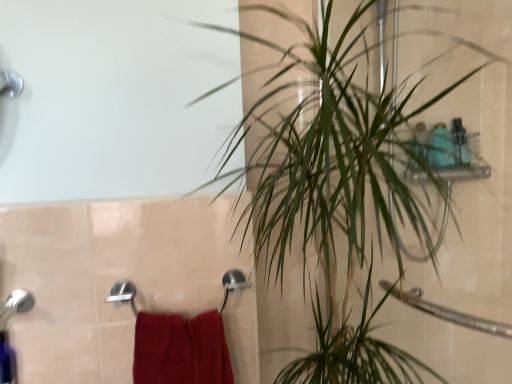
Question: Can you confirm if red cotton towel at lower left is smaller than green leafy plant at upper right?

Choices:
 (A) no
 (B) yes

Answer: (B)

Question: From the image's perspective, is red cotton towel at lower left under green leafy plant at upper right?

Choices:
 (A) yes
 (B) no

Answer: (A)

Question: Is red cotton towel at lower left positioned beyond the bounds of green leafy plant at upper right?

Choices:
 (A) no
 (B) yes

Answer: (B)

Question: Does red cotton towel at lower left have a larger size compared to green leafy plant at upper right?

Choices:
 (A) no
 (B) yes

Answer: (A)

Question: Does red cotton towel at lower left turn towards green leafy plant at upper right?

Choices:
 (A) no
 (B) yes

Answer: (A)

Question: From a real-world perspective, is red cotton towel at lower left physically above green leafy plant at upper right?

Choices:
 (A) no
 (B) yes

Answer: (A)

Question: Is green leafy plant at upper right looking in the opposite direction of red cotton towel at lower left?

Choices:
 (A) no
 (B) yes

Answer: (A)

Question: Is the position of green leafy plant at upper right less distant than that of red cotton towel at lower left?

Choices:
 (A) no
 (B) yes

Answer: (B)

Question: From a real-world perspective, is green leafy plant at upper right positioned over red cotton towel at lower left based on gravity?

Choices:
 (A) yes
 (B) no

Answer: (A)

Question: Is green leafy plant at upper right wider than red cotton towel at lower left?

Choices:
 (A) yes
 (B) no

Answer: (A)

Question: From a real-world perspective, is green leafy plant at upper right physically below red cotton towel at lower left?

Choices:
 (A) no
 (B) yes

Answer: (A)

Question: Is green leafy plant at upper right far away from red cotton towel at lower left?

Choices:
 (A) no
 (B) yes

Answer: (A)

Question: Is green leafy plant at upper right bigger or smaller than red cotton towel at lower left?

Choices:
 (A) big
 (B) small

Answer: (A)